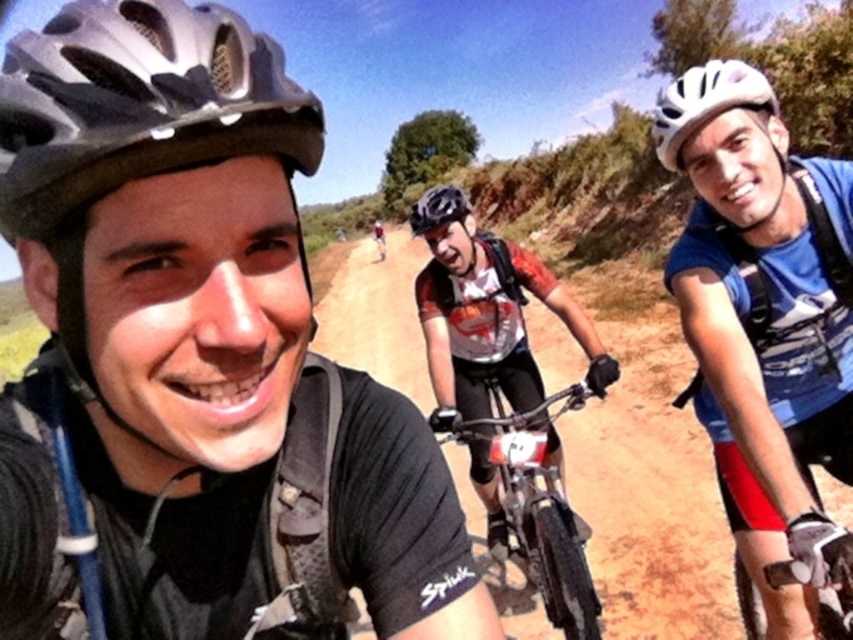
Is point (488, 388) more distant than point (653, 134)?

Yes, point (488, 388) is behind point (653, 134).

Between shiny metallic bike at center and white matte bicycle helmet at upper right, which one is positioned lower?

shiny metallic bike at center

Between point (558, 582) and point (740, 68), which one is positioned behind?

Positioned behind is point (558, 582).

Locate an element on the screen. The width and height of the screenshot is (853, 640). shiny metallic bike at center is located at coordinates (537, 502).

Who is positioned more to the left, metallic silver helmet at upper left or matte black helmet at center?

From the viewer's perspective, matte black helmet at center appears more on the left side.

Can you confirm if metallic silver helmet at upper left is positioned to the left of matte black helmet at center?

Incorrect, metallic silver helmet at upper left is not on the left side of matte black helmet at center.

Is point (132, 145) farther from viewer compared to point (467, 204)?

That is False.

Identify the location of metallic silver helmet at upper left. The height and width of the screenshot is (640, 853). (138, 104).

Consider the image. Is shiny metallic bike at center shorter than matte black helmet at center?

Indeed, shiny metallic bike at center has a lesser height compared to matte black helmet at center.

Between shiny metallic bike at center and matte black helmet at center, which one is positioned lower?

shiny metallic bike at center is lower down.

I want to click on shiny metallic bike at center, so click(537, 502).